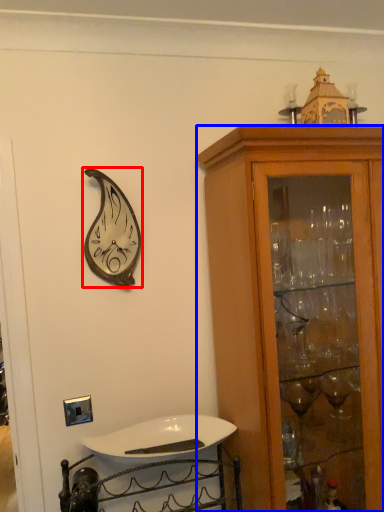
Question: Among these objects, which one is nearest to the camera, clock (highlighted by a red box) or cabinetry (highlighted by a blue box)?

Choices:
 (A) clock
 (B) cabinetry

Answer: (B)